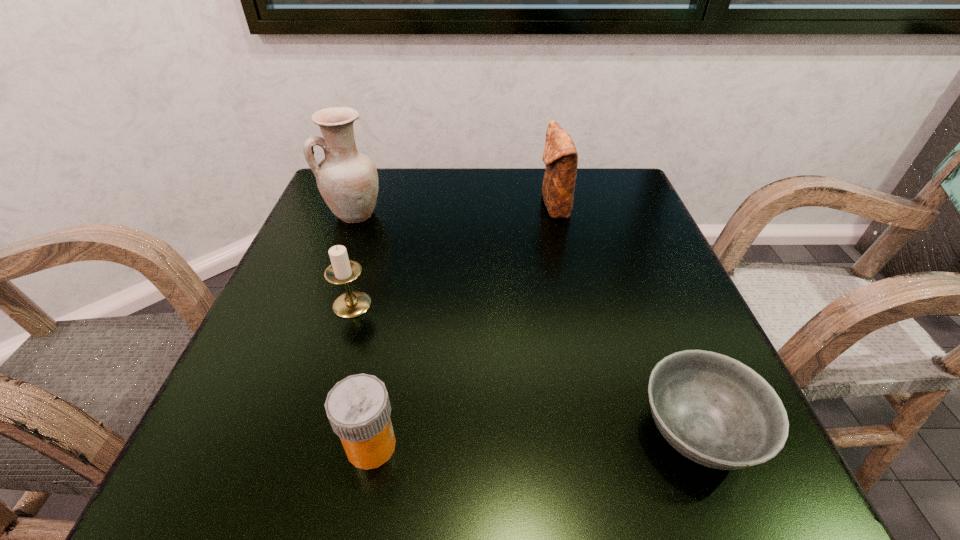
The image size is (960, 540). Identify the location of the tallest object. (347, 180).

The image size is (960, 540). In order to click on the second object from right to left in this screenshot , I will do `click(560, 156)`.

Locate an element on the screen. Image resolution: width=960 pixels, height=540 pixels. the fourth shortest object is located at coordinates (560, 156).

Locate an element on the screen. The image size is (960, 540). the third tallest object is located at coordinates (342, 270).

Locate an element on the screen. This screenshot has width=960, height=540. the third farthest object is located at coordinates (342, 270).

Where is `the third object from left to right`? the third object from left to right is located at coordinates (358, 408).

I want to click on medicine, so click(x=358, y=408).

Locate an element on the screen. the shortest object is located at coordinates (716, 411).

Where is `the rightmost object`? the rightmost object is located at coordinates (716, 411).

What are the coordinates of `vacant space located 0.050m on the front of the tallest object` in the screenshot? It's located at (343, 245).